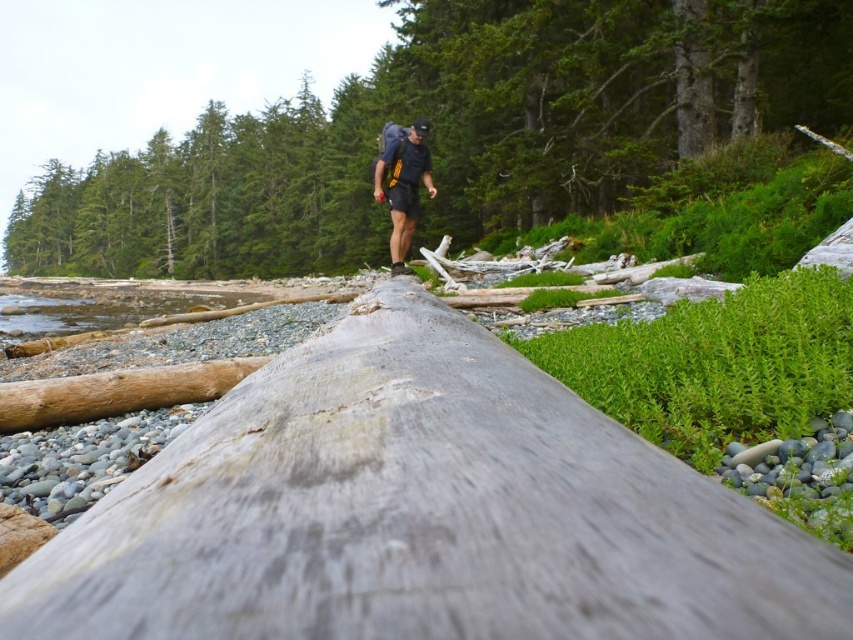
Based on the photo, does weathered gray log at center appear on the left side of matte black backpack at center?

No, weathered gray log at center is not to the left of matte black backpack at center.

Can you confirm if weathered gray log at center is smaller than matte black backpack at center?

Yes, weathered gray log at center is smaller than matte black backpack at center.

The width and height of the screenshot is (853, 640). Find the location of `weathered gray log at center`. weathered gray log at center is located at coordinates (421, 513).

In order to click on weathered gray log at center in this screenshot , I will do `click(421, 513)`.

Can you confirm if smooth gray log at center is wider than matte black backpack at center?

Correct, the width of smooth gray log at center exceeds that of matte black backpack at center.

Does smooth gray log at center have a smaller size compared to matte black backpack at center?

No, smooth gray log at center is not smaller than matte black backpack at center.

This screenshot has height=640, width=853. What do you see at coordinates (447, 134) in the screenshot?
I see `smooth gray log at center` at bounding box center [447, 134].

Find the location of a particular element. smooth gray log at center is located at coordinates (447, 134).

Is weathered gray log at center taller than smooth gray log at center?

No.

Does weathered gray log at center come in front of smooth gray log at center?

Yes, weathered gray log at center is in front of smooth gray log at center.

Is point (267, 605) behind point (457, 1)?

No, (267, 605) is closer to viewer.

This screenshot has width=853, height=640. What are the coordinates of `weathered gray log at center` in the screenshot? It's located at (421, 513).